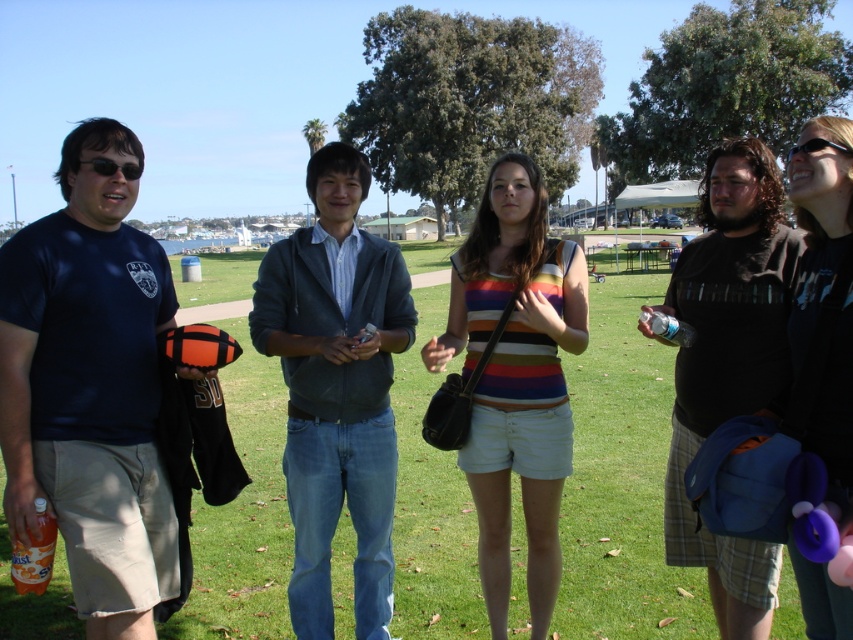
You are organizing a clothing donation drive and need to determine if the dark brown textured shirt at right and the black plastic sunglasses at upper right can fit into a donation box that has a maximum width capacity of 30 cm. Given their widths, can both items fit side by side in the box?

The dark brown textured shirt at right has a width less than the black plastic sunglasses at upper right. However, since the total width of both items combined is unknown, it is impossible to determine if they can fit side by side in the donation box with a 30 cm width limit without knowing the exact widths of each item.

Looking at this image, you are a photographer trying to capture a group photo of the matte black shirt at upper right and the matte black sunglasses at left. If you want to ensure both subjects are in focus, which one should you adjust the camera focus on first?

The matte black shirt at upper right has a larger width than the matte black sunglasses at left, so you should adjust the camera focus on the matte black shirt at upper right first to ensure both are in focus.